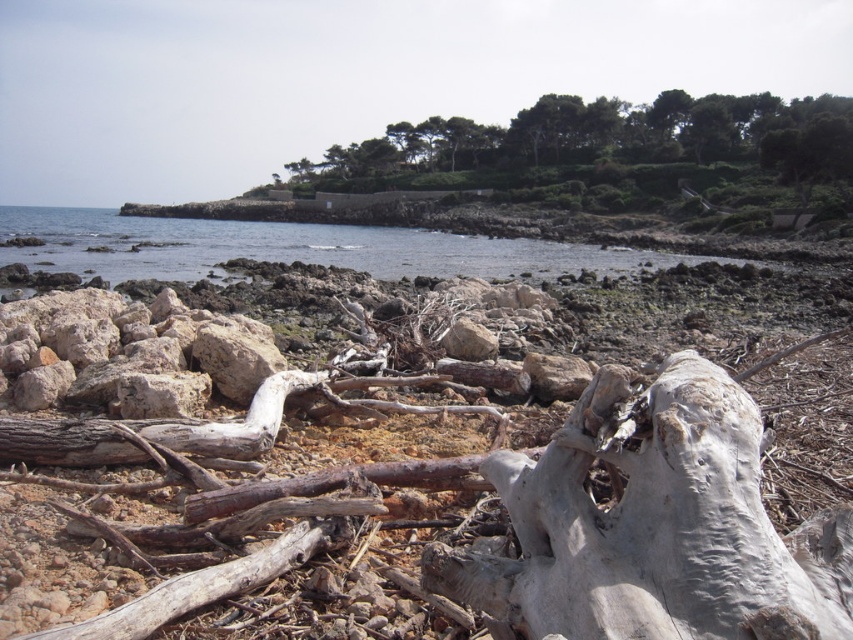
You are standing on the rocky shoreline and want to reach the point marked at coordinates point [753,541]. Given that you can move 3 feet per second, how many seconds will it take you to reach that point?

The point marked at coordinates point [753,541] is 7.42 feet away from the viewer. At a speed of 3 feet per second, it would take approximately 2.47 seconds to reach there.

You are standing on the rocky shoreline and notice the white weathered wood at center and the green leafy trees at upper center. Which object takes up more space in the scene?

The green leafy trees at upper center take up more space in the scene than the white weathered wood at center because they are larger in size according to the description.

You are standing on the rocky shoreline looking towards the water. You see the green leafy trees at upper center and the clear blue water at center. Which object is higher in the image?

The green leafy trees at upper center are higher in the image than the clear blue water at center.